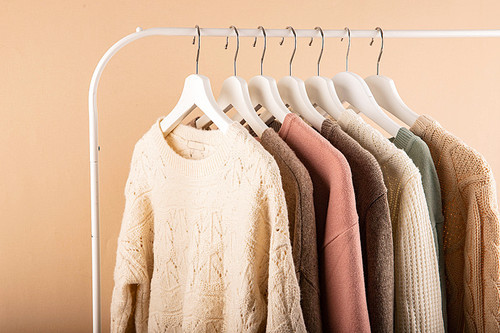
Image resolution: width=500 pixels, height=333 pixels. I want to click on garment on clothes hanger (long sleeved), so click(x=252, y=171), click(x=295, y=170), click(x=325, y=167), click(x=367, y=167), click(x=395, y=166), click(x=426, y=164), click(x=461, y=167).